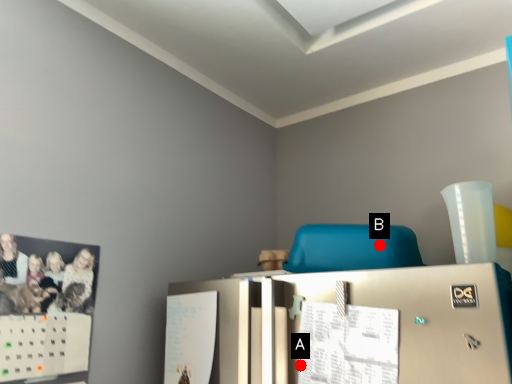
Question: Two points are circled on the image, labeled by A and B beside each circle. Which point is farther from the camera taking this photo?

Choices:
 (A) A is further
 (B) B is further

Answer: (B)